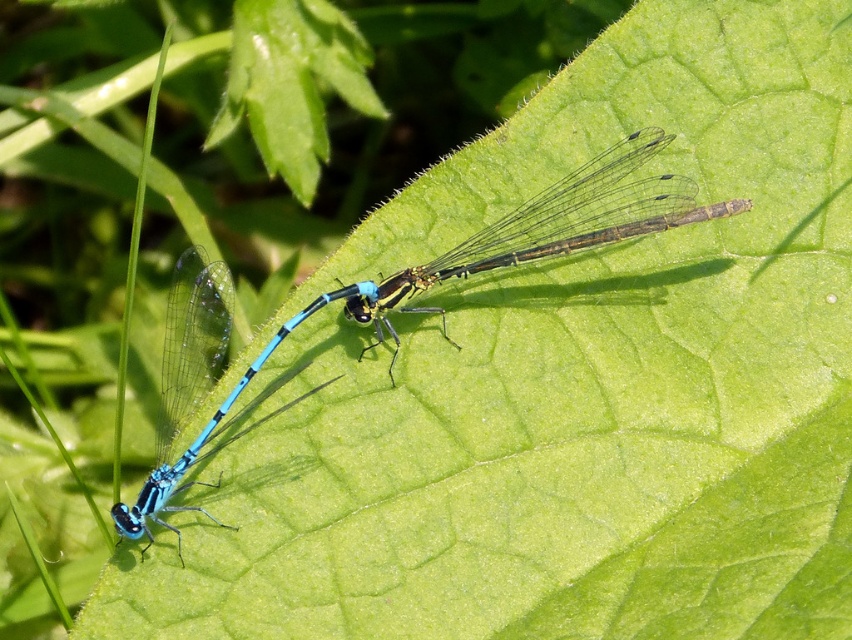
Describe the element at coordinates (415, 292) in the screenshot. I see `blue glossy dragonfly at center` at that location.

Is point (496, 259) less distant than point (137, 508)?

That is False.

Where is `blue glossy dragonfly at center`? The height and width of the screenshot is (640, 852). blue glossy dragonfly at center is located at coordinates (415, 292).